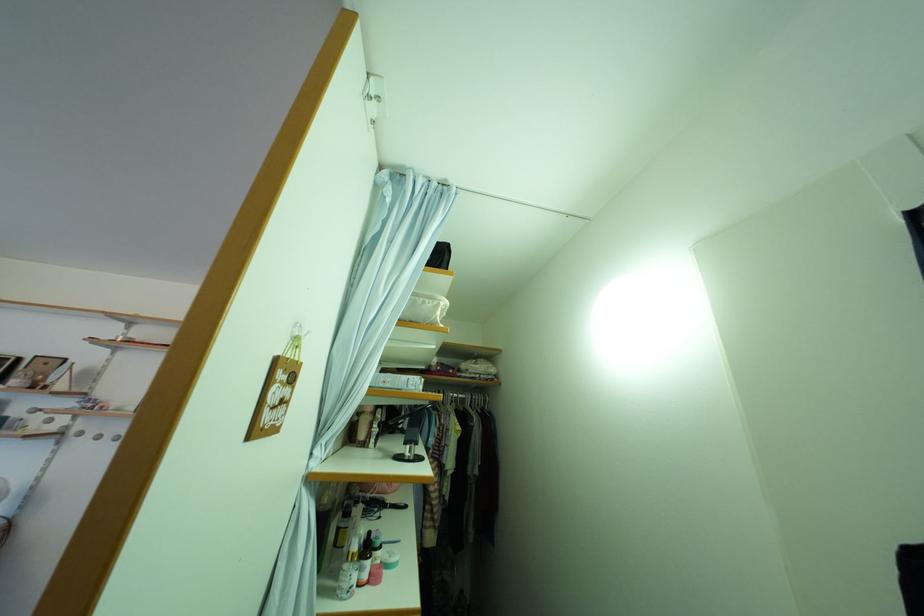
Locate an element on the screen. Image resolution: width=924 pixels, height=616 pixels. white woven basket is located at coordinates (424, 309).